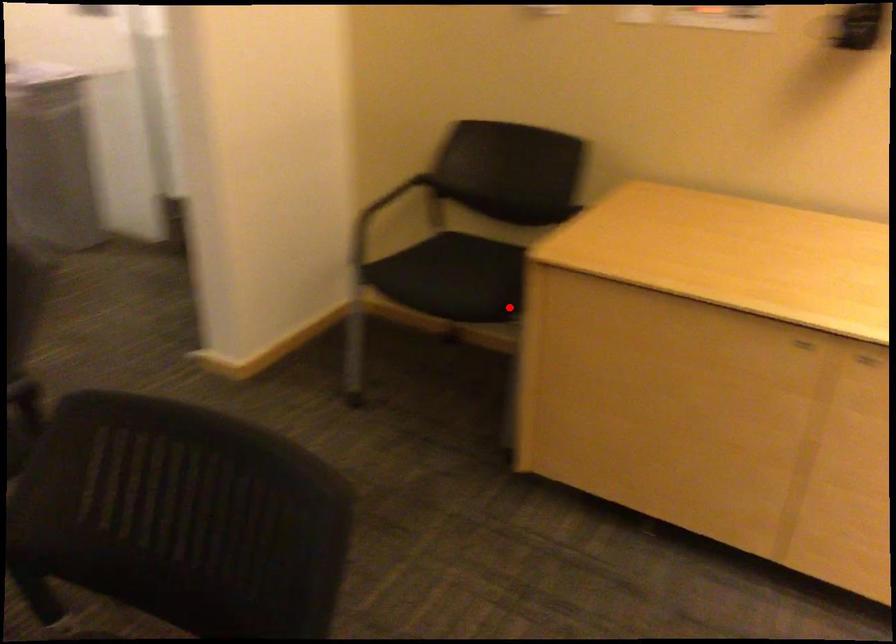
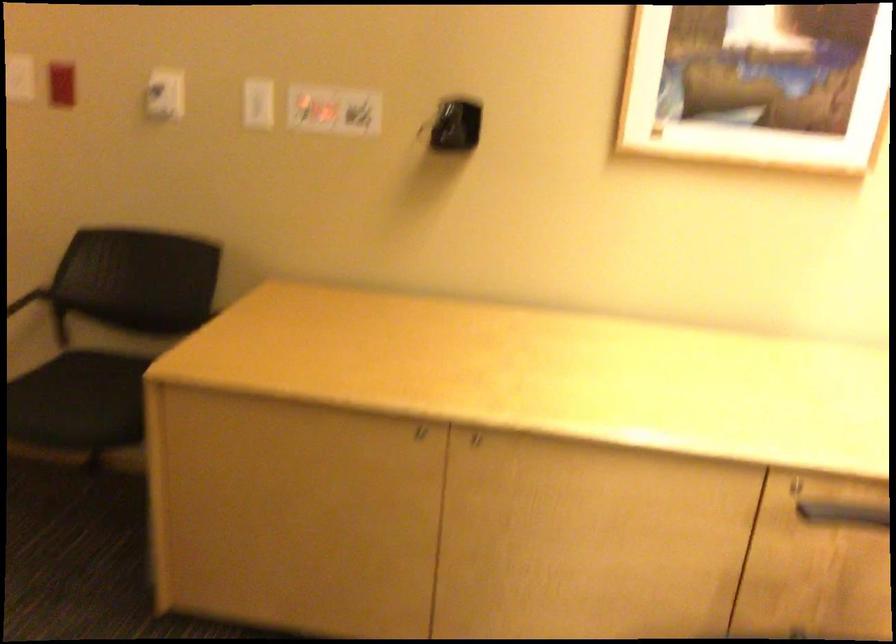
Question: I am providing you with two images of the same scene from different viewpoints. In image1, a red point is highlighted. Considering the same 3D point in image2, which of the following is correct?

Choices:
 (A) It is closer
 (B) It is farther

Answer: (A)